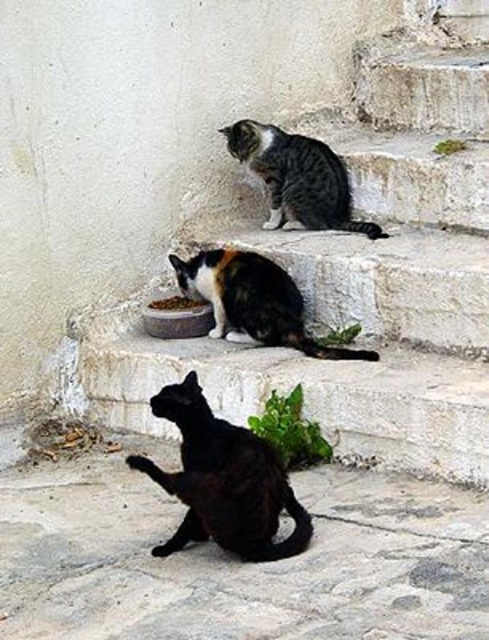
You are a photographer trying to capture a group photo of the calico fur cat at center and the striped fur cat at upper center. Since you want to ensure both cats are in focus, you need to know which one is closer to the camera. Can you determine which cat is nearer based on their sizes?

The calico fur cat at center is larger in size than the striped fur cat at upper center, so the calico fur cat at center is closer to the camera since objects appear larger when they are nearer.

From the picture: You are a person standing at the bottom of the white stone stairs at center and want to pet the black matte cat at lower center. Which direction should you move to reach the cat?

The white stone stairs at center is positioned on the right side of the black matte cat at lower center. Therefore, you should move to the left to reach the cat.